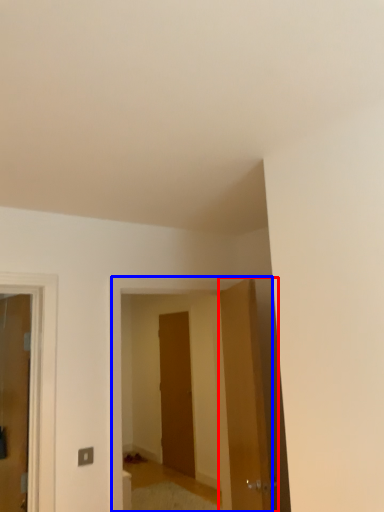
Question: Which point is further to the camera, door (highlighted by a red box) or elevator (highlighted by a blue box)?

Choices:
 (A) door
 (B) elevator

Answer: (B)